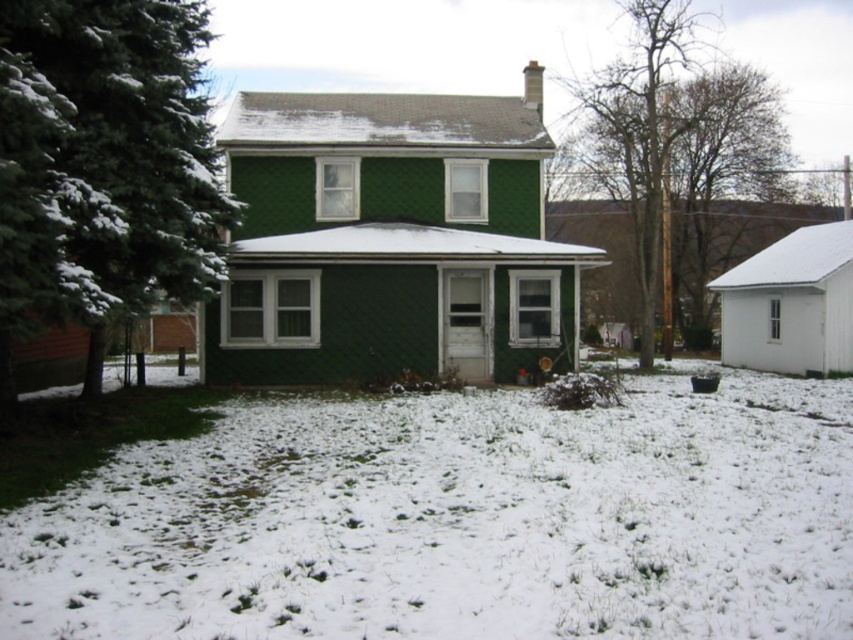
Does green textured evergreen tree at left have a smaller size compared to bare wood pole at upper right?

Yes.

Does point (132, 131) lie behind point (712, 156)?

No, it is not.

Find the location of `green textured evergreen tree at left`. green textured evergreen tree at left is located at coordinates (103, 164).

Does point (170, 467) come behind point (161, 180)?

No, it is not.

The height and width of the screenshot is (640, 853). Identify the location of white fluffy snow at center. (459, 522).

The height and width of the screenshot is (640, 853). Describe the element at coordinates (459, 522) in the screenshot. I see `white fluffy snow at center` at that location.

You are a GUI agent. You are given a task and a screenshot of the screen. Output one action in this format:
    pyautogui.click(x=<x>, y=<y>)
    Task: Click on the white fluffy snow at center
    The image size is (853, 640).
    Given the screenshot: What is the action you would take?
    pyautogui.click(x=459, y=522)

In the scene shown: Measure the distance between point (486, 474) and camera.

A distance of 9.95 meters exists between point (486, 474) and camera.

Can you confirm if white fluffy snow at center is positioned below bare wood pole at upper right?

Indeed, white fluffy snow at center is positioned under bare wood pole at upper right.

Is point (827, 531) farther from viewer compared to point (676, 92)?

No, it is not.

The image size is (853, 640). I want to click on white fluffy snow at center, so click(459, 522).